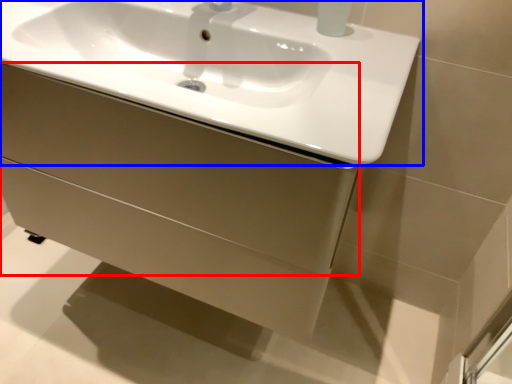
Question: Which point is further to the camera, drawer (highlighted by a red box) or sink (highlighted by a blue box)?

Choices:
 (A) drawer
 (B) sink

Answer: (A)